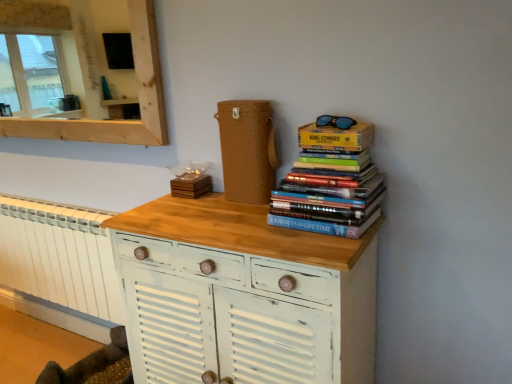
Question: Is blue reflective lenses at upper right in front of or behind white distressed wood chest of drawers at center in the image?

Choices:
 (A) front
 (B) behind

Answer: (B)

Question: From a real-world perspective, is blue reflective lenses at upper right physically located above or below white distressed wood chest of drawers at center?

Choices:
 (A) above
 (B) below

Answer: (A)

Question: Which of these objects is positioned farthest from the wooden coaster at center, which is the second paperback book from right to left?

Choices:
 (A) white painted radiator at lower left
 (B) white distressed wood chest of drawers at center
 (C) hardcover books at upper right
 (D) yellow cardboard box at upper right, which ranks as the 1th paperback book in right-to-left order
 (E) blue reflective lenses at upper right

Answer: (A)

Question: Which of these objects is positioned closest to the yellow cardboard box at upper right, which is counted as the 1th paperback book, starting from the front?

Choices:
 (A) wooden mirror at upper left
 (B) hardcover books at upper right
 (C) wooden coaster at center, arranged as the 2th paperback book when viewed from the top
 (D) white painted radiator at lower left
 (E) white distressed wood chest of drawers at center

Answer: (B)